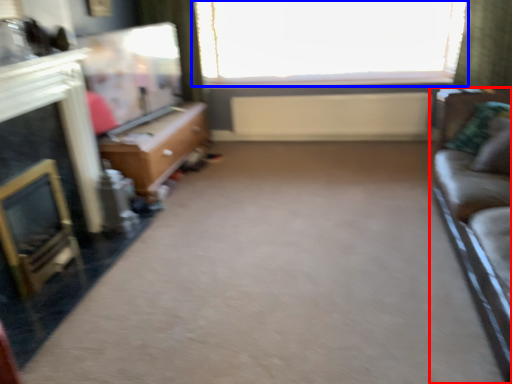
Question: Among these objects, which one is farthest to the camera, studio couch (highlighted by a red box) or window (highlighted by a blue box)?

Choices:
 (A) studio couch
 (B) window

Answer: (B)